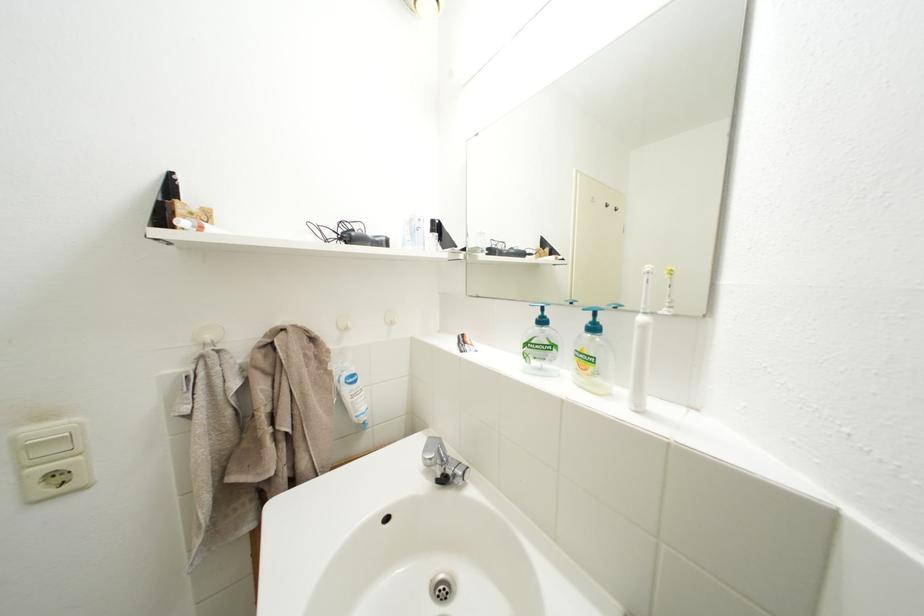
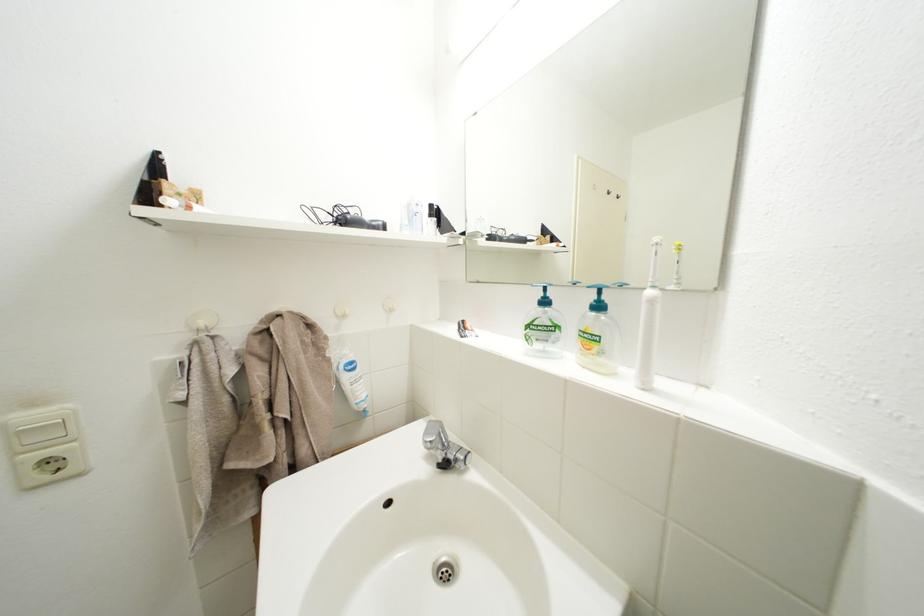
Find the pixel in the second image that matches pixel 601 325 in the first image.

(604, 302)